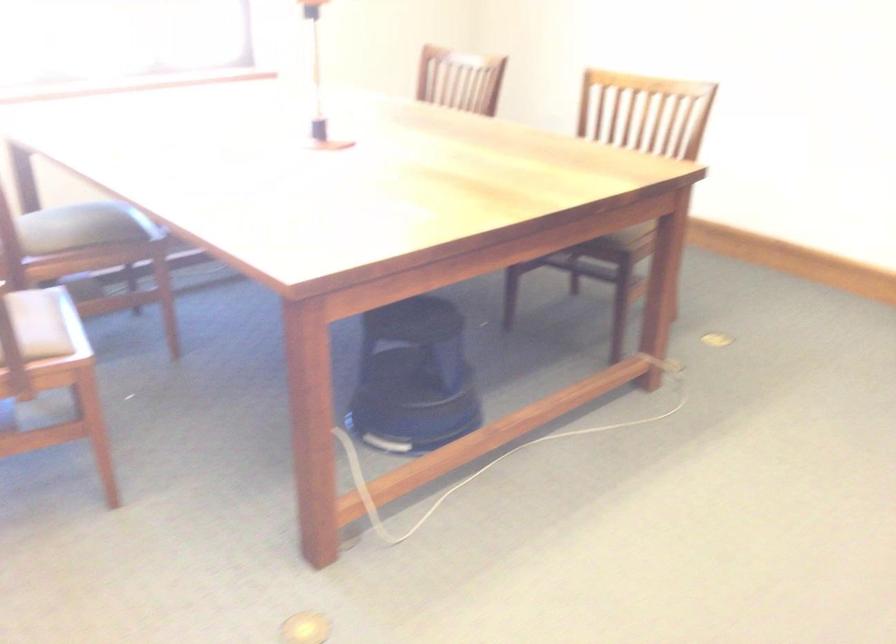
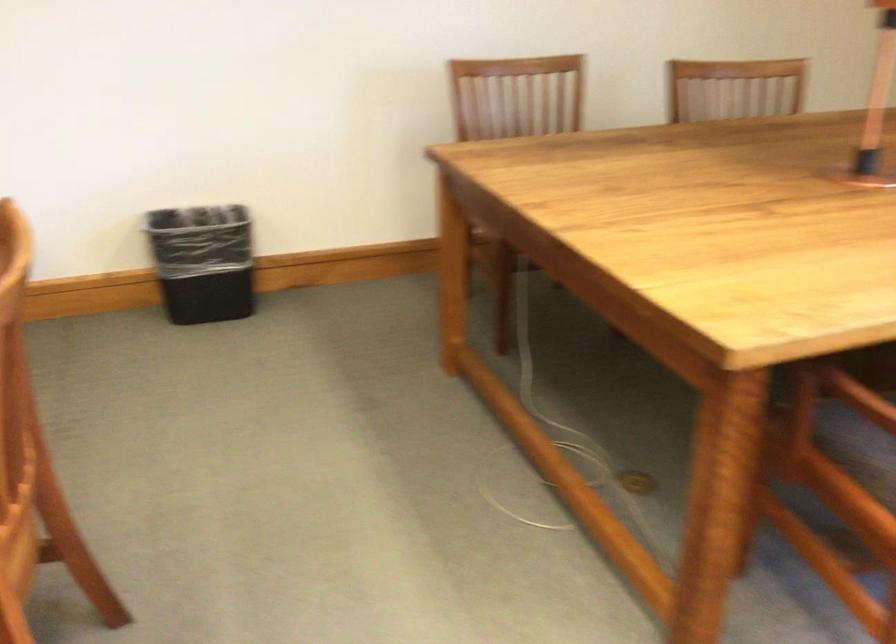
The first image is from the beginning of the video and the second image is from the end. How did the camera likely rotate when shooting the video?

The camera rotated toward left-down.